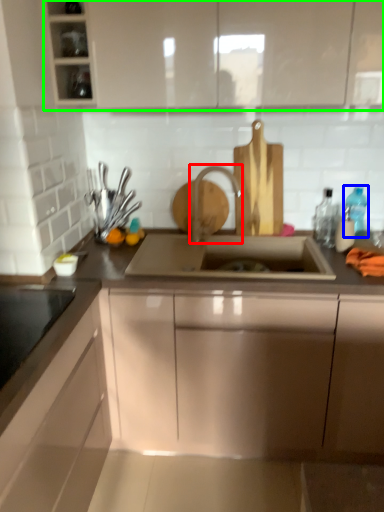
Question: Which object is positioned closest to tap (highlighted by a red box)? Select from bottle (highlighted by a blue box) and cabinetry (highlighted by a green box).

Choices:
 (A) bottle
 (B) cabinetry

Answer: (B)